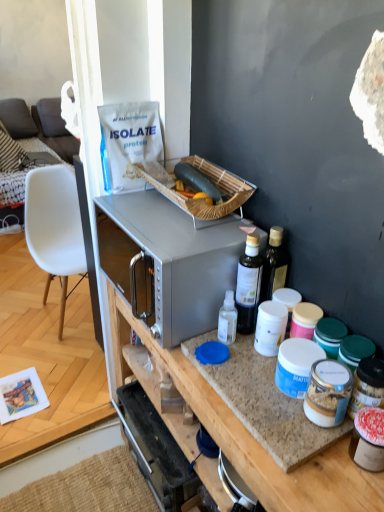
Identify the location of free space above granite countertop at center (from a real-world perspective). This screenshot has height=512, width=384. (258, 377).